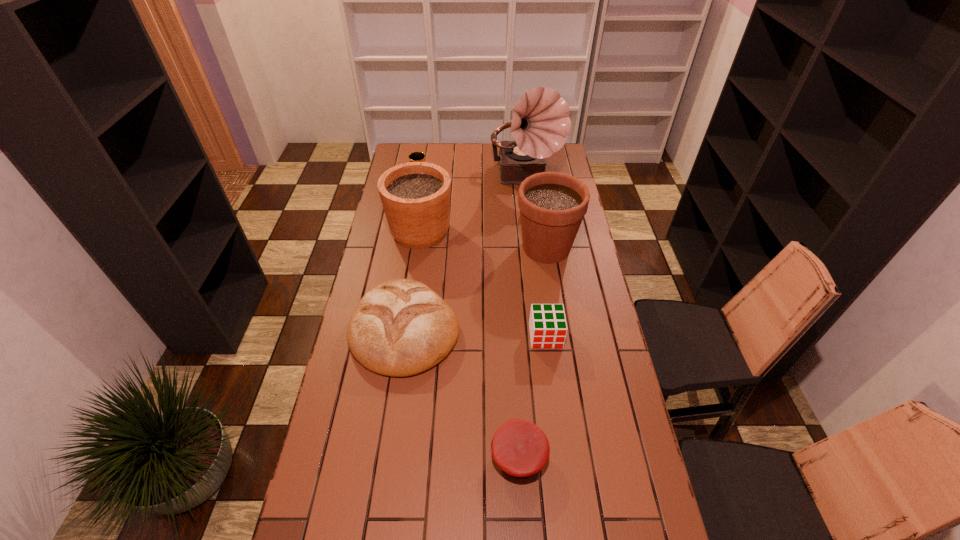
In order to click on free point located 0.070m on the front of the left flowerpot in this screenshot , I will do `click(416, 266)`.

What are the coordinates of `free space located 0.110m on the left of the chalice` in the screenshot? It's located at (389, 179).

Where is `vacant space located on the back of the bread`? vacant space located on the back of the bread is located at coordinates (420, 227).

Find the location of a particular element. The image size is (960, 540). free point located on the red face of the cube is located at coordinates (557, 422).

I want to click on vacant space located at the front of the shortest object where the visor is located, so click(427, 456).

The image size is (960, 540). What are the coordinates of `free space located 0.150m at the front of the shortest object where the visor is located` in the screenshot? It's located at (438, 456).

You are a GUI agent. You are given a task and a screenshot of the screen. Output one action in this format:
    pyautogui.click(x=<x>, y=<y>)
    Task: Click on the vacant space situated at the front of the shortest object where the visor is located
    
    Given the screenshot: What is the action you would take?
    pyautogui.click(x=381, y=456)

You are a GUI agent. You are given a task and a screenshot of the screen. Output one action in this format:
    pyautogui.click(x=<x>, y=<y>)
    Task: Click on the object that is at the far edge
    
    Given the screenshot: What is the action you would take?
    pyautogui.click(x=540, y=123)

Find the location of `flowerpot that is at the left edge`. flowerpot that is at the left edge is located at coordinates (415, 196).

Identify the location of chalice present at the left edge. This screenshot has height=540, width=960. (415, 156).